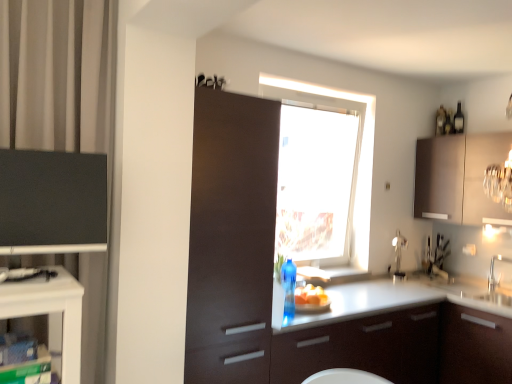
Question: Based on their positions, is white glossy countertop at center located to the left or right of transparent glass window at center?

Choices:
 (A) left
 (B) right

Answer: (B)

Question: In the image, is white glossy countertop at center positioned in front of or behind transparent glass window at center?

Choices:
 (A) behind
 (B) front

Answer: (B)

Question: Estimate the real-world distances between objects in this image. Which object is farther from the yellow matte bread at lower center?

Choices:
 (A) transparent glass window at center
 (B) white glossy sink at right
 (C) white glossy countertop at center
 (D) black glass bottle at upper right
 (E) matte black cabinet at left, acting as the 3th cabinetry starting from the back

Answer: (D)

Question: Estimate the real-world distances between objects in this image. Which object is closer to the transparent glass window at center?

Choices:
 (A) black glass bottle at upper right
 (B) matte brown cabinet at center, the 2th cabinetry from the back
 (C) matte black cabinet at left, acting as the 3th cabinetry starting from the back
 (D) yellow matte bread at lower center
 (E) white glossy countertop at center

Answer: (E)